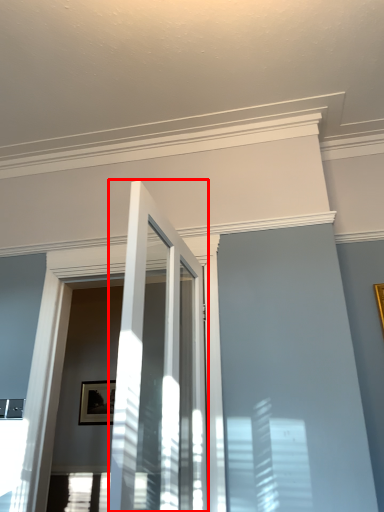
Question: From the image's perspective, what is the correct spatial positioning of door (annotated by the red box) in reference to picture frame?

Choices:
 (A) above
 (B) below

Answer: (A)